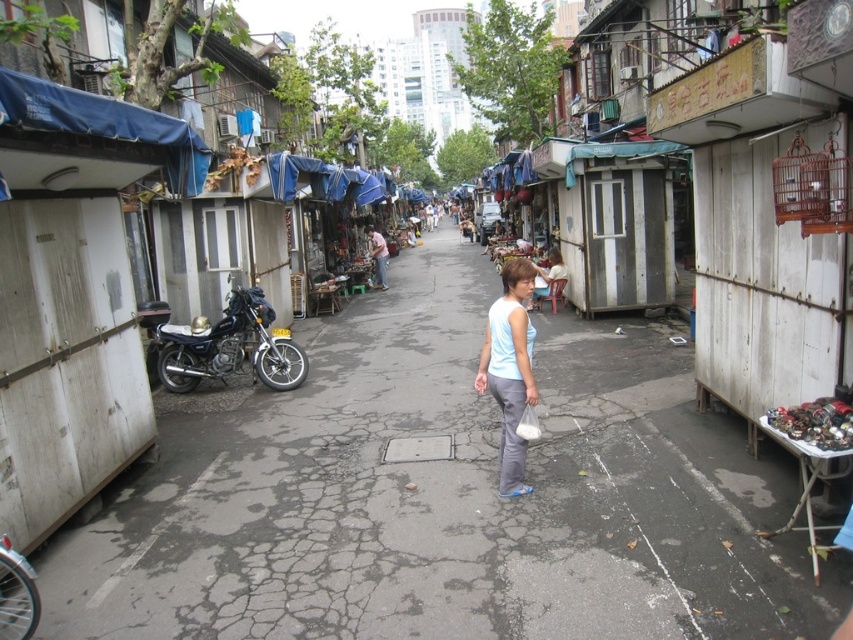
From the picture: You are a delivery person standing on the gray cracked pavement at center and need to reach the shiny blue motorcycle at left. Which direction should you move to get closer to the motorcycle?

The gray cracked pavement at center is closer to the viewer than the shiny blue motorcycle at left, so you should move towards the left direction to get closer to the shiny blue motorcycle at left.

You are standing on the sidewalk in this narrow street scene, and you need to cross the street to reach a destination on the opposite side. There is a shiny blue motorcycle at left. Can you safely cross the street without getting too close to the motorcycle?

The shiny blue motorcycle at left is 8.54 meters away from you, so yes, you can safely cross the street without getting too close to the motorcycle as there is sufficient distance between you and it.

You are a delivery person trying to park your motorcycle between the gray cracked pavement at center and the light blue fabric at center. Which side should you park closer to if you want to avoid the cracked area?

You should park closer to the light blue fabric at center because the gray cracked pavement at center is to the left of it, meaning the light blue fabric at center is on the right side where the pavement is not cracked.